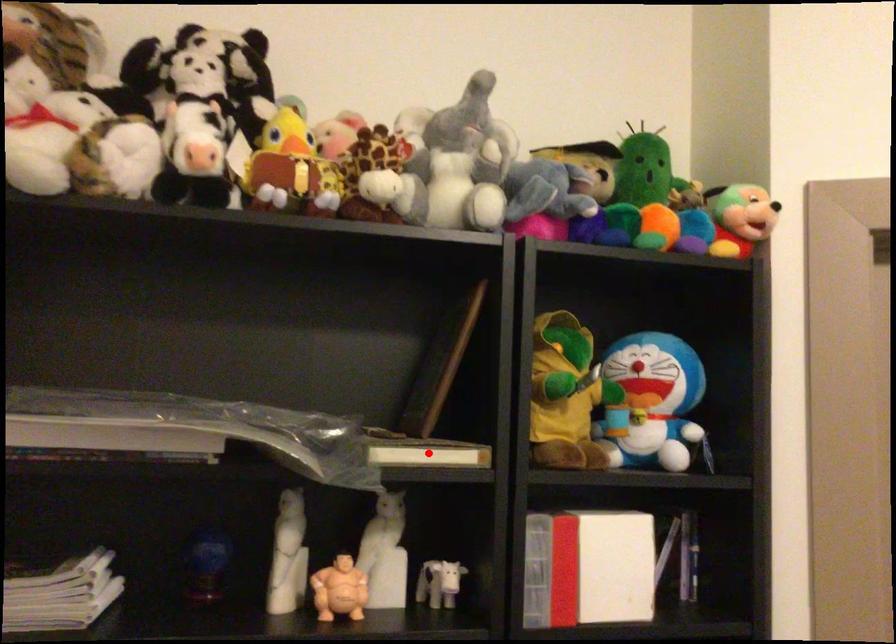
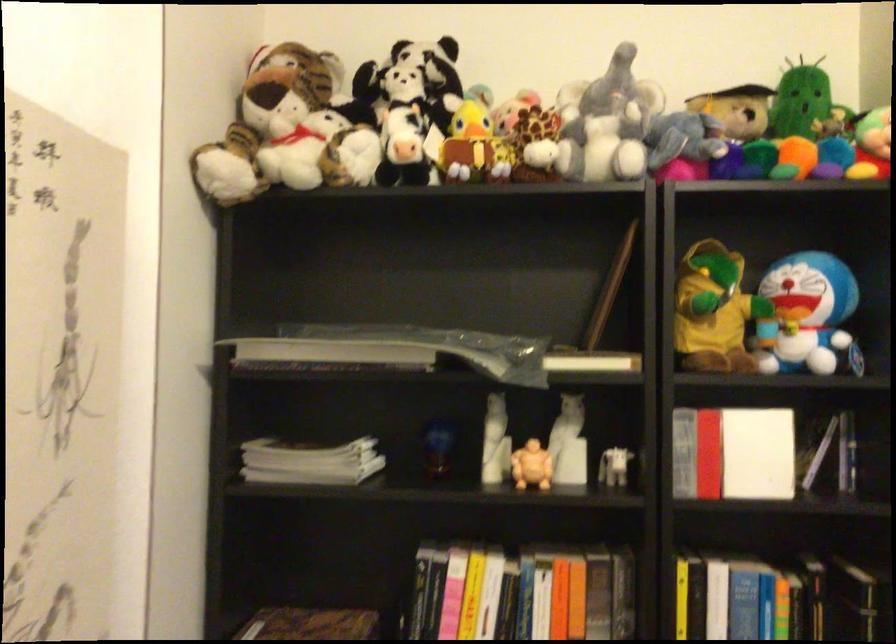
In the second image, find the point that corresponds to the highlighted location in the first image.

(591, 361)